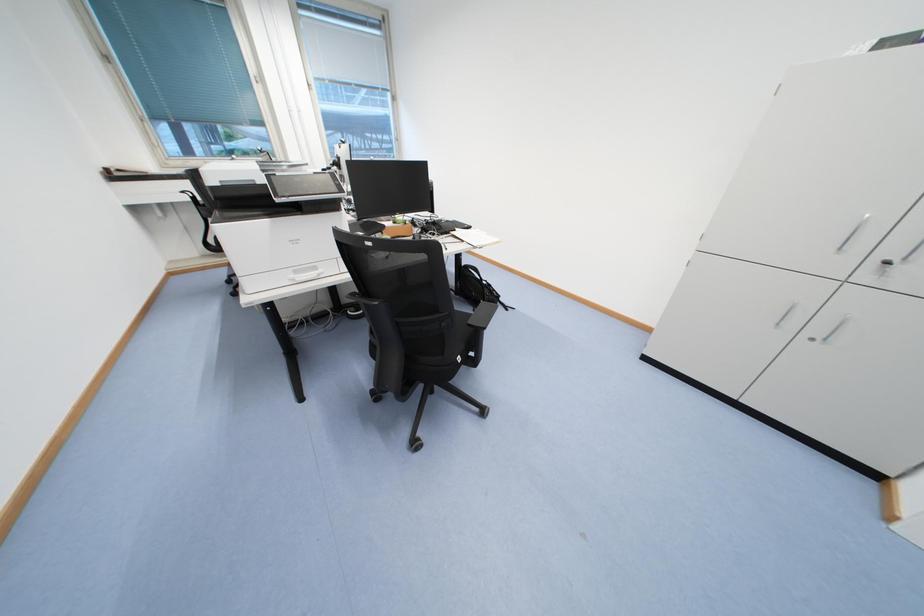
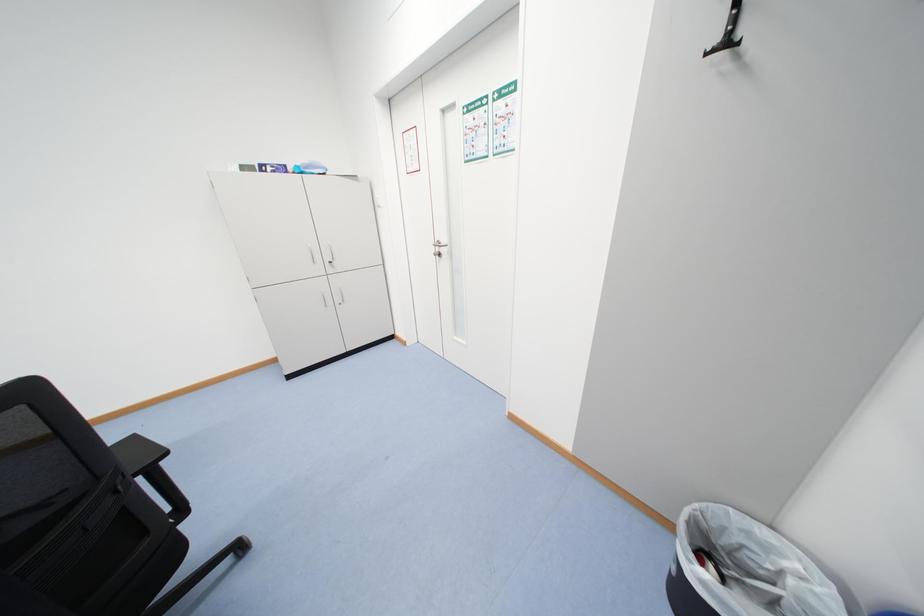
The images are taken continuously from a first-person perspective. In which direction is your viewpoint rotating?

The camera's rotation is toward right-down.